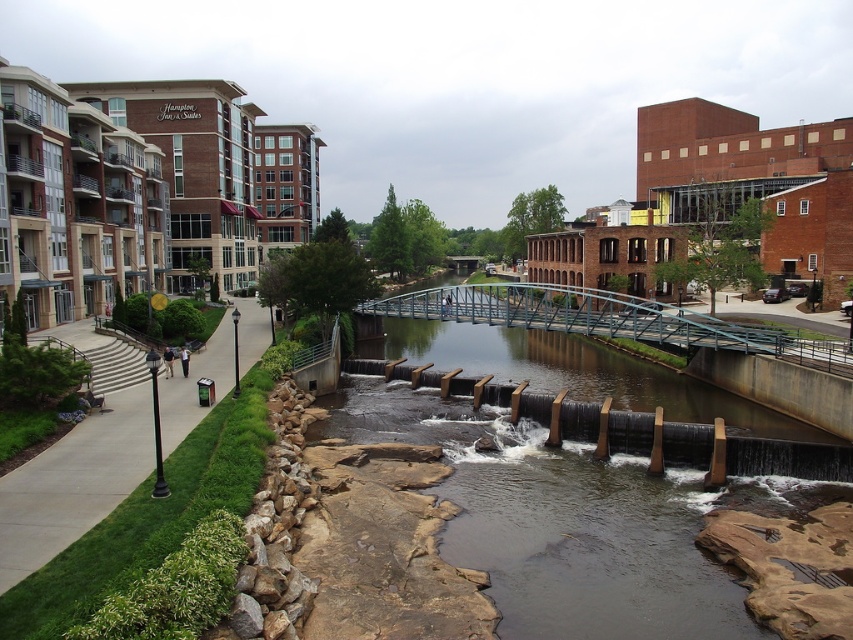
You are a landscape architect designing a new park. You have to decide whether to place a 3m wide walkway between the brown stone stream at center and the green grass at left. Based on their widths, will the walkway fit if it is placed between them?

The brown stone stream at center is wider than the green grass at left. Since the walkway is 3 meters wide, it depends on the actual width of the stream. However, the description only states the stream is wider than the grass but doesn

You are standing at the riverside and want to take a photo of both the brown stone stream at center and the green grass at left. Which object should you focus on first to ensure both are in the frame?

You should focus on the brown stone stream at center first since it is closer to you than the green grass at left, ensuring both are in the frame by adjusting the camera angle accordingly.

You are standing at the origin point in the urban riverside scene. There are two points marked in the image, point A at coordinates point A is point [618,486] and point B at coordinates point B is point [30,522]. If you want to reach both points, which point should you visit first to ensure you can see both points from your current position?

You should visit point B first because point A is behind point B from your current position at the origin, so visiting point B first allows you to see both points without obstruction.